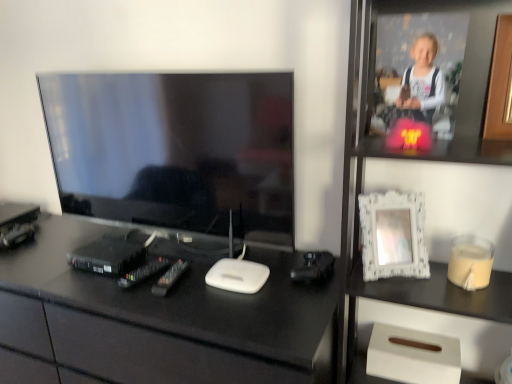
Question: Is matte black tv at left surrounding wooden at upper right, the first picture frame viewed from the right?

Choices:
 (A) no
 (B) yes

Answer: (A)

Question: Considering the relative positions of matte black tv at left and wooden at upper right, the first picture frame viewed from the right, in the image provided, is matte black tv at left to the left of wooden at upper right, the first picture frame viewed from the right, from the viewer's perspective?

Choices:
 (A) yes
 (B) no

Answer: (A)

Question: Can you confirm if matte black tv at left is shorter than wooden at upper right, the second picture frame positioned from the left?

Choices:
 (A) yes
 (B) no

Answer: (B)

Question: Does matte black tv at left have a greater height compared to wooden at upper right, which is counted as the second picture frame, starting from the bottom?

Choices:
 (A) no
 (B) yes

Answer: (B)

Question: From the image's perspective, is matte black tv at left on top of wooden at upper right, the first picture frame positioned from the top?

Choices:
 (A) yes
 (B) no

Answer: (B)

Question: Considering the relative sizes of matte black tv at left and wooden at upper right, which is counted as the second picture frame, starting from the bottom, in the image provided, is matte black tv at left thinner than wooden at upper right, which is counted as the second picture frame, starting from the bottom,?

Choices:
 (A) no
 (B) yes

Answer: (B)

Question: Considering the relative sizes of white lace picture frame at upper right, which is the 1th picture frame from bottom to top, and black glossy desk at center in the image provided, is white lace picture frame at upper right, which is the 1th picture frame from bottom to top, smaller than black glossy desk at center?

Choices:
 (A) yes
 (B) no

Answer: (A)

Question: Would you consider white lace picture frame at upper right, which is counted as the second picture frame, starting from the right, to be distant from black glossy desk at center?

Choices:
 (A) no
 (B) yes

Answer: (A)

Question: Is white lace picture frame at upper right, which is the 1th picture frame from bottom to top, not inside black glossy desk at center?

Choices:
 (A) yes
 (B) no

Answer: (A)

Question: Is white lace picture frame at upper right, the second picture frame from the top, directly adjacent to black glossy desk at center?

Choices:
 (A) no
 (B) yes

Answer: (A)

Question: From the image's perspective, is white lace picture frame at upper right, which is the 1th picture frame from bottom to top, under black glossy desk at center?

Choices:
 (A) no
 (B) yes

Answer: (A)

Question: Considering the relative sizes of white lace picture frame at upper right, which is counted as the second picture frame, starting from the right, and black glossy desk at center in the image provided, is white lace picture frame at upper right, which is counted as the second picture frame, starting from the right, wider than black glossy desk at center?

Choices:
 (A) no
 (B) yes

Answer: (A)

Question: Can you confirm if white textured frame at upper right is bigger than matte black tv at left?

Choices:
 (A) yes
 (B) no

Answer: (A)